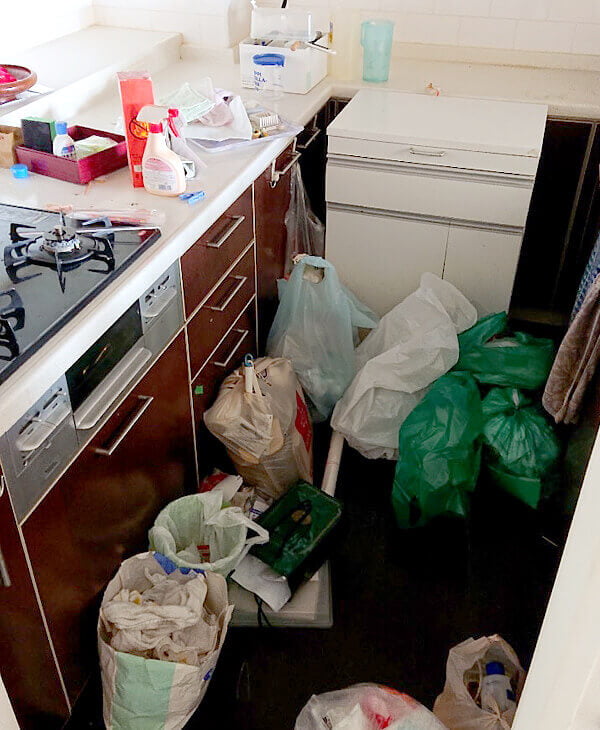
The height and width of the screenshot is (730, 600). Find the location of `hob`. hob is located at coordinates (38, 285).